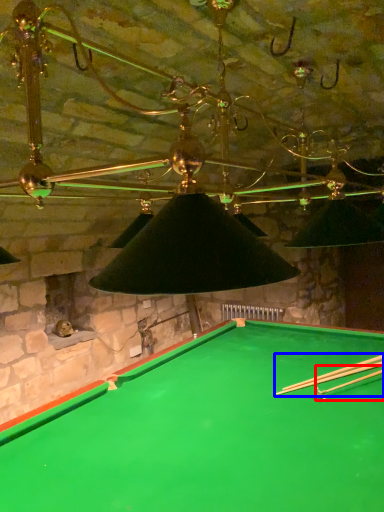
Question: Which of the following is the farthest to the observer, cue (highlighted by a red box) or cue (highlighted by a blue box)?

Choices:
 (A) cue
 (B) cue

Answer: (B)